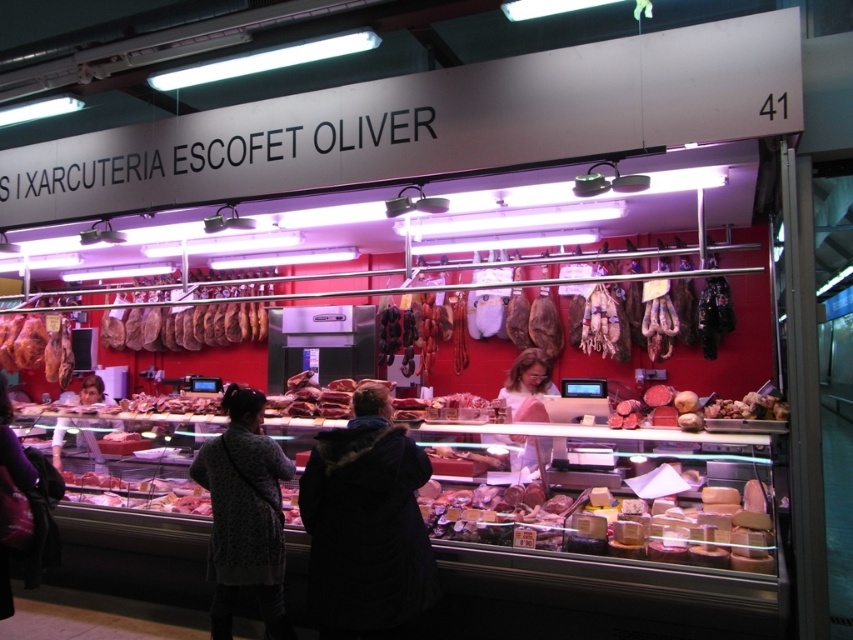
Can you confirm if white cheese at center is positioned to the right of smooth pink meat at center?

No, white cheese at center is not to the right of smooth pink meat at center.

Is white cheese at center thinner than smooth pink meat at center?

No, white cheese at center is not thinner than smooth pink meat at center.

This screenshot has height=640, width=853. In order to click on white cheese at center in this screenshot , I will do `click(604, 529)`.

Locate an element on the screen. The image size is (853, 640). white cheese at center is located at coordinates (604, 529).

Based on the photo, is brown leather meat at center in front of smooth pink meat at center?

That is False.

Is point (184, 326) behind point (697, 403)?

Yes.

Between point (154, 324) and point (653, 420), which one is positioned in front?

Positioned in front is point (653, 420).

This screenshot has height=640, width=853. What are the coordinates of `brown leather meat at center` in the screenshot? It's located at (193, 324).

Can you confirm if dark blue coat at center is positioned to the right of matte brown ham at left?

Yes, dark blue coat at center is to the right of matte brown ham at left.

The width and height of the screenshot is (853, 640). I want to click on dark blue coat at center, so click(366, 525).